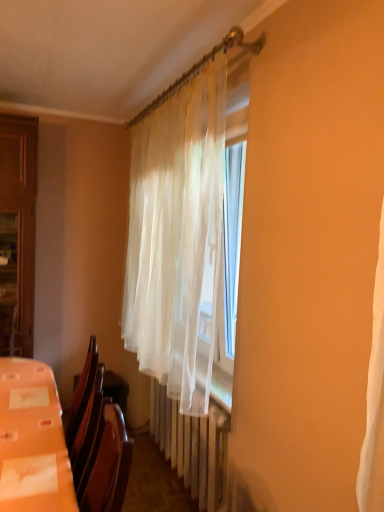
Question: Is translucent white curtain at center inside or outside of orange plastic table at lower left?

Choices:
 (A) inside
 (B) outside

Answer: (B)

Question: From the image's perspective, is translucent white curtain at center above or below orange plastic table at lower left?

Choices:
 (A) below
 (B) above

Answer: (B)

Question: Which of these objects is positioned farthest from the white plastic radiator at center?

Choices:
 (A) orange plastic table at lower left
 (B) translucent white curtain at center

Answer: (A)

Question: Based on their relative distances, which object is nearer to the orange plastic table at lower left?

Choices:
 (A) translucent white curtain at center
 (B) white plastic radiator at center

Answer: (B)